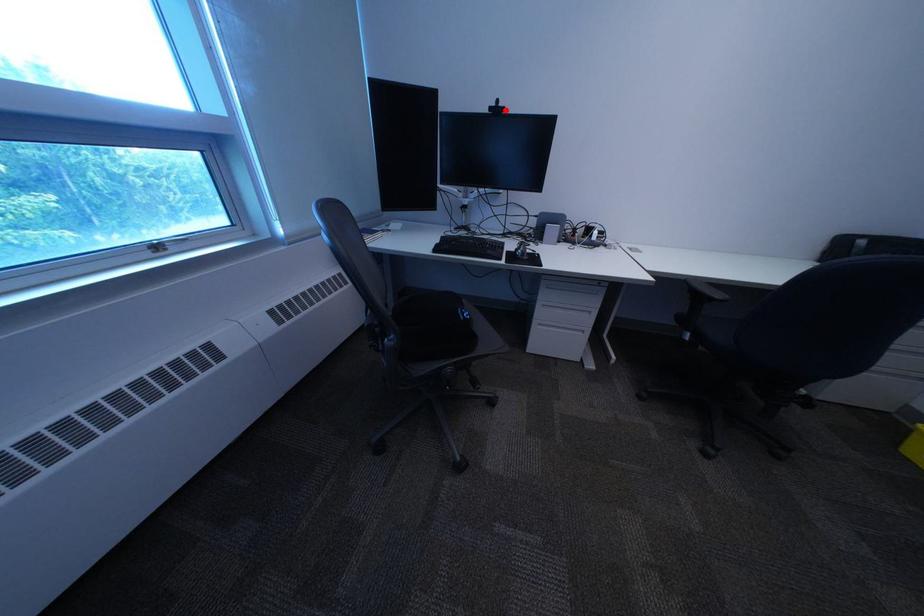
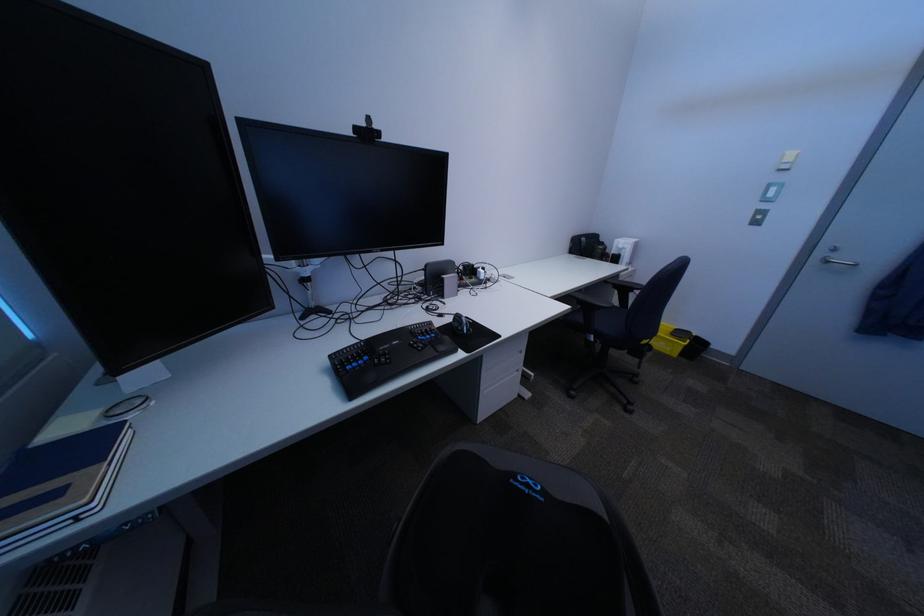
Find the pixel in the second image that matches the highlighted location in the first image.

(371, 131)